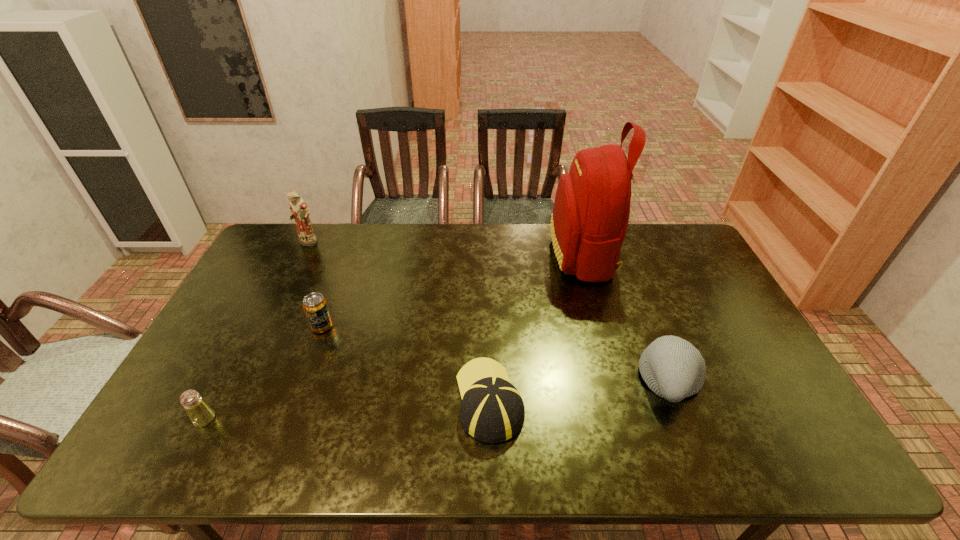
Locate an element on the screen. blank space located on the front-facing side of the figurine is located at coordinates (270, 321).

What are the coordinates of `vacant space situated 0.400m on the left of the beanie` in the screenshot? It's located at (489, 380).

Where is `vacant space located on the back of the third farthest object`? The width and height of the screenshot is (960, 540). vacant space located on the back of the third farthest object is located at coordinates (331, 302).

Identify the location of vacant space located with the brim of the baseball cap facing forward. (487, 274).

The height and width of the screenshot is (540, 960). I want to click on free space located with the brim of the baseball cap facing forward, so click(488, 317).

Image resolution: width=960 pixels, height=540 pixels. In order to click on vacant space situated with the brim of the baseball cap facing forward in this screenshot , I will do `click(488, 327)`.

Locate an element on the screen. vacant area situated on the left of the saltshaker is located at coordinates (170, 419).

Find the location of `backpack that is at the far edge`. backpack that is at the far edge is located at coordinates (591, 210).

Identify the location of figurine at the far edge. The image size is (960, 540). (299, 210).

Locate an element on the screen. The image size is (960, 540). object that is at the near edge is located at coordinates click(x=492, y=411).